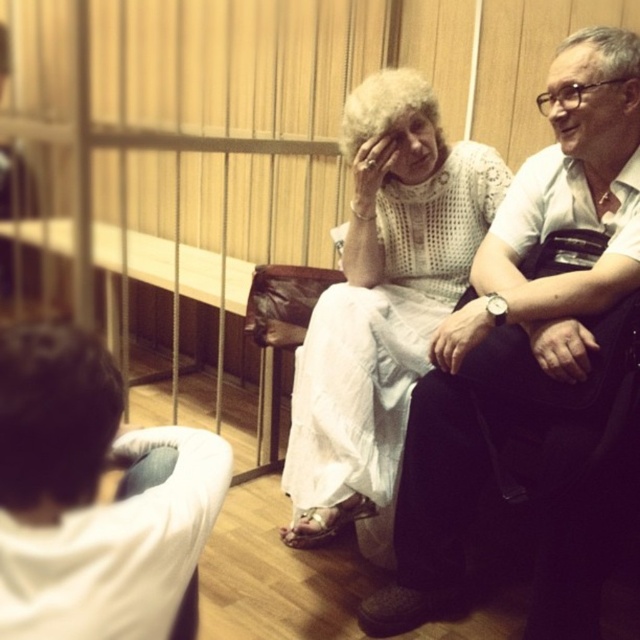
Question: Which object is the farthest from the dark brown hair at lower left?

Choices:
 (A) white lace dress at center
 (B) white fabric shirt at upper right

Answer: (B)

Question: Considering the relative positions of white lace dress at center and dark brown hair at lower left in the image provided, where is white lace dress at center located with respect to dark brown hair at lower left?

Choices:
 (A) right
 (B) left

Answer: (A)

Question: Among these objects, which one is farthest from the camera?

Choices:
 (A) dark brown hair at lower left
 (B) white lace dress at center

Answer: (B)

Question: Which object is farther from the camera taking this photo?

Choices:
 (A) white fabric shirt at upper right
 (B) dark brown hair at lower left

Answer: (A)

Question: Is white fabric shirt at upper right smaller than white lace dress at center?

Choices:
 (A) no
 (B) yes

Answer: (B)

Question: Does white fabric shirt at upper right come behind dark brown hair at lower left?

Choices:
 (A) yes
 (B) no

Answer: (A)